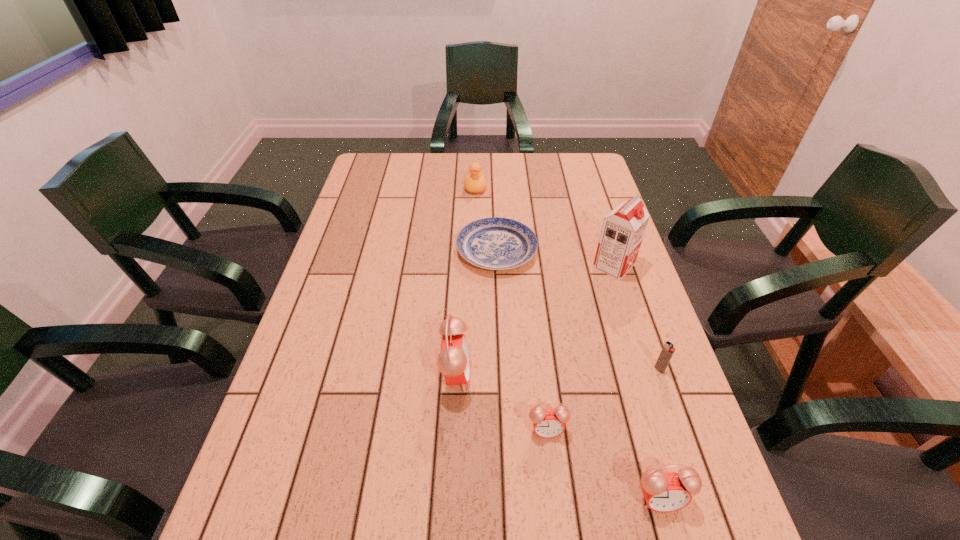
Please show where to add a alarm clock on the left while keeping spacing even. Please provide its 2D coordinates. Your answer should be formatted as a tuple, i.e. [(x, y)], where the tuple contains the x and y coordinates of a point satisfying the conditions above.

[(380, 328)]